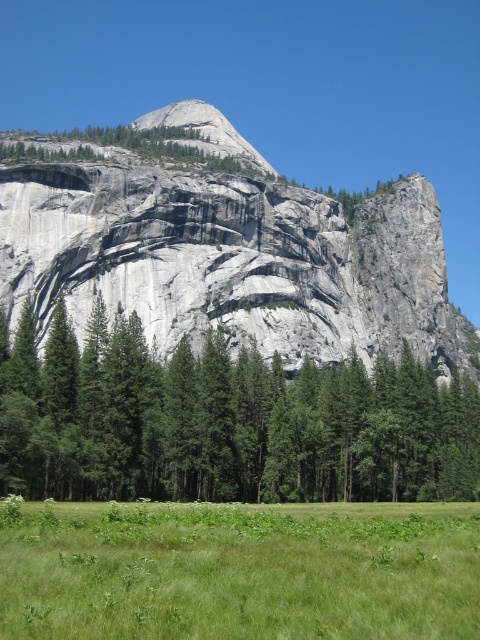
Question: Which point is farther from the camera taking this photo?

Choices:
 (A) (225, 385)
 (B) (41, 595)

Answer: (A)

Question: Among these objects, which one is nearest to the camera?

Choices:
 (A) green matte tree at center
 (B) green grassy pasture at lower center

Answer: (B)

Question: Does green matte tree at center appear on the right side of green grassy pasture at lower center?

Choices:
 (A) no
 (B) yes

Answer: (B)

Question: Which object appears closest to the camera in this image?

Choices:
 (A) green matte tree at center
 (B) green grassy pasture at lower center
 (C) gray/granite mountain at center

Answer: (B)

Question: Does green matte tree at center have a smaller size compared to green grassy pasture at lower center?

Choices:
 (A) yes
 (B) no

Answer: (B)

Question: From the image, what is the correct spatial relationship of gray/granite mountain at center in relation to green matte tree at center?

Choices:
 (A) left
 (B) right

Answer: (A)